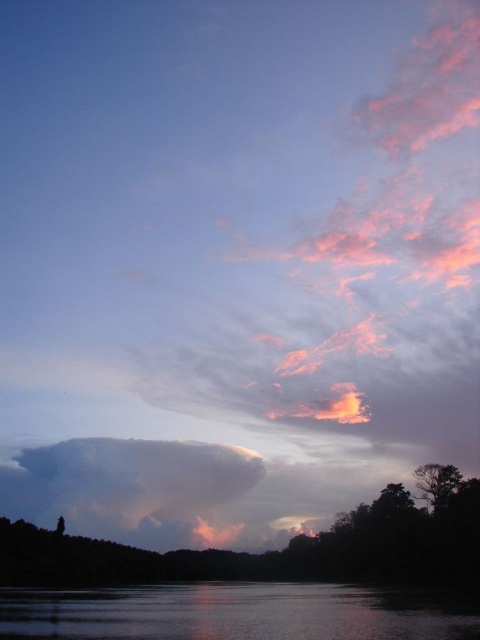
Question: Among these points, which one is farthest from the camera?

Choices:
 (A) (445, 534)
 (B) (395, 620)
 (C) (427, 499)
 (D) (197, 524)

Answer: (D)

Question: Which object is the farthest from the glistening water at lower center?

Choices:
 (A) silhouette wood at lower center
 (B) green matte tree at lower right
 (C) smokey gray cloud at center

Answer: (C)

Question: Is the position of smokey gray cloud at center more distant than that of green matte tree at lower right?

Choices:
 (A) no
 (B) yes

Answer: (B)

Question: Based on their relative distances, which object is farther from the green matte tree at lower right?

Choices:
 (A) silhouette wood at lower center
 (B) smokey gray cloud at center
 (C) glistening water at lower center

Answer: (B)

Question: Where is silhouette wood at lower center located in relation to glistening water at lower center in the image?

Choices:
 (A) right
 (B) left

Answer: (A)

Question: Is smokey gray cloud at center below green matte tree at lower right?

Choices:
 (A) yes
 (B) no

Answer: (A)